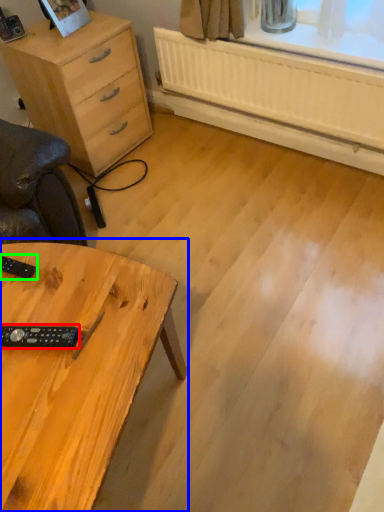
Question: Which is nearer to the control (highlighted by a red box)? table (highlighted by a blue box) or control (highlighted by a green box).

Choices:
 (A) table
 (B) control

Answer: (A)